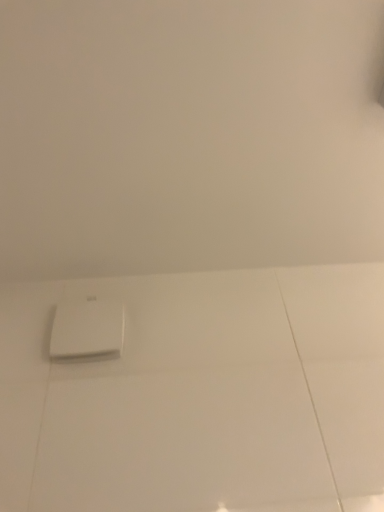
Question: From the image's perspective, would you say white plastic air vent at center is shown under white matte wall at upper center?

Choices:
 (A) yes
 (B) no

Answer: (A)

Question: Does white plastic air vent at center have a greater width compared to white matte wall at upper center?

Choices:
 (A) no
 (B) yes

Answer: (A)

Question: Could you tell me if white plastic air vent at center is facing white matte wall at upper center?

Choices:
 (A) no
 (B) yes

Answer: (A)

Question: From the image's perspective, is white plastic air vent at center over white matte wall at upper center?

Choices:
 (A) no
 (B) yes

Answer: (A)

Question: Does white plastic air vent at center appear on the left side of white matte wall at upper center?

Choices:
 (A) yes
 (B) no

Answer: (A)

Question: Is white plastic air vent at center further to the viewer compared to white matte wall at upper center?

Choices:
 (A) yes
 (B) no

Answer: (A)

Question: Is white matte wall at upper center at the right side of white plastic air vent at center?

Choices:
 (A) no
 (B) yes

Answer: (B)

Question: From a real-world perspective, does white matte wall at upper center sit lower than white plastic air vent at center?

Choices:
 (A) yes
 (B) no

Answer: (B)

Question: Is white matte wall at upper center facing towards white plastic air vent at center?

Choices:
 (A) yes
 (B) no

Answer: (B)

Question: Does white matte wall at upper center have a greater height compared to white plastic air vent at center?

Choices:
 (A) no
 (B) yes

Answer: (A)

Question: Is white matte wall at upper center turned away from white plastic air vent at center?

Choices:
 (A) yes
 (B) no

Answer: (B)

Question: Considering the relative sizes of white matte wall at upper center and white plastic air vent at center in the image provided, is white matte wall at upper center smaller than white plastic air vent at center?

Choices:
 (A) no
 (B) yes

Answer: (A)

Question: Considering the positions of point (334, 56) and point (71, 320), is point (334, 56) closer or farther from the camera than point (71, 320)?

Choices:
 (A) farther
 (B) closer

Answer: (B)